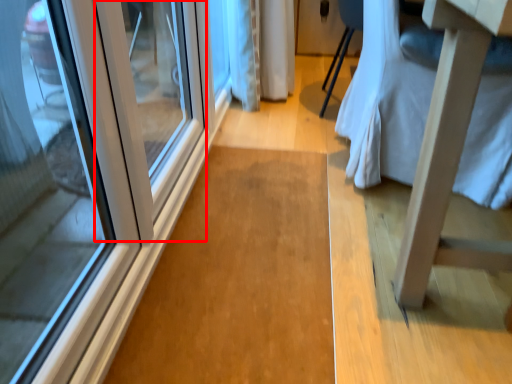
Question: From the image's perspective, where is door (annotated by the red box) located in relation to changing table in the image?

Choices:
 (A) below
 (B) above

Answer: (A)